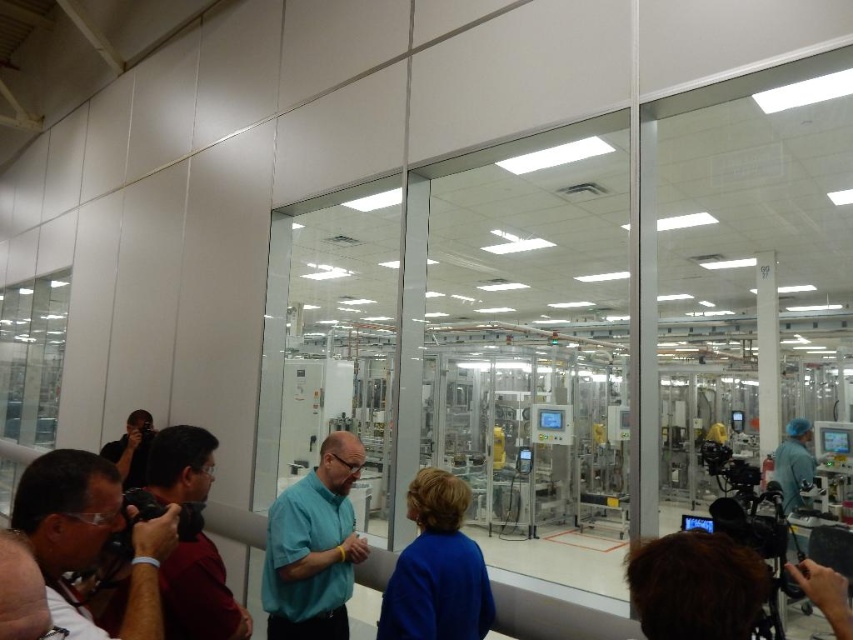
Is matte black camera at lower left above matte black camera at left?

Correct, matte black camera at lower left is located above matte black camera at left.

Does point (38, 563) come closer to viewer compared to point (196, 554)?

Yes, point (38, 563) is in front of point (196, 554).

You are a GUI agent. You are given a task and a screenshot of the screen. Output one action in this format:
    pyautogui.click(x=<x>, y=<y>)
    Task: Click on the matte black camera at lower left
    The image size is (853, 640).
    Given the screenshot: What is the action you would take?
    pyautogui.click(x=90, y=538)

Between matte teal shirt at center and matte black camera at left, which one appears on the left side from the viewer's perspective?

Positioned to the left is matte black camera at left.

Is matte teal shirt at center above matte black camera at left?

No, matte teal shirt at center is not above matte black camera at left.

The height and width of the screenshot is (640, 853). I want to click on matte teal shirt at center, so click(314, 547).

I want to click on matte teal shirt at center, so click(314, 547).

Who is lower down, matte black camera at lower left or matte teal shirt at center?

matte teal shirt at center is below.

Which is more to the right, matte black camera at lower left or matte teal shirt at center?

From the viewer's perspective, matte teal shirt at center appears more on the right side.

Where is `matte black camera at lower left`? The width and height of the screenshot is (853, 640). matte black camera at lower left is located at coordinates (90, 538).